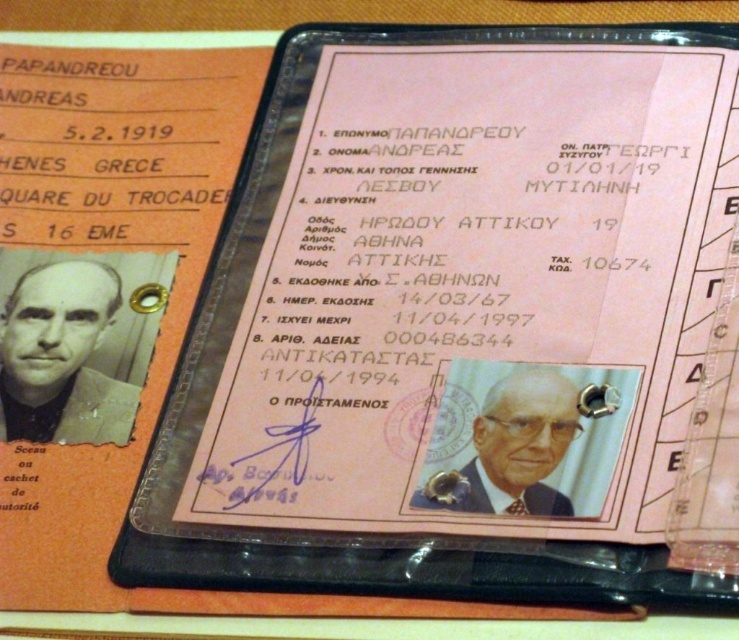
You are a passport control officer checking two documents. The first document has a gray hair man at left and the other has a white textured photo at center. Based on the documents, which person appears taller?

The gray hair man at left appears taller than the white textured photo at center because the gray hair man at left has a greater height compared to the white textured photo at center.

You are a passport control officer checking these documents. You need to compare the size of the gray hair man at left and the white textured photo at center. Which one is bigger?

The gray hair man at left is larger in size than the white textured photo at center, so the gray hair man at left is bigger.